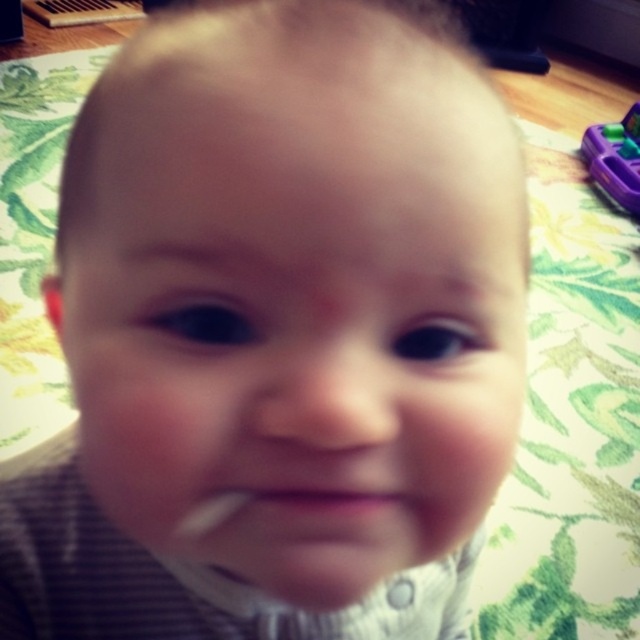
You are a photographer adjusting the focus on a camera that captured this image. You notice two points in the frame at coordinates point (616, 196) and point (221, 502). Which point is closer to the camera lens?

Point (221, 502) is closer to the camera lens because the description states that point (616, 196) is behind point (221, 502).

Please describe the location of the purple plastic toy at upper right in the image using coordinates. The coordinate system has the origin at the bottom left corner of the image, with the x and y axes increasing to the right and up respectively. The maximum x and y values are both 1.0. Please provide the coordinates as a point in the format of a tuple with two decimal numbers separated by a comma, such as 0.5,0.5.

The purple plastic toy at upper right is located at point (616, 160).

You are holding a purple plastic toy at upper right and want to place it on a shelf that is 2 meters away from you. Can you place it there without moving your position?

The distance between the purple plastic toy at upper right and the viewer is 1.87 meters. Since the shelf is 2 meters away, you can place it there without moving because the distance is within reach.